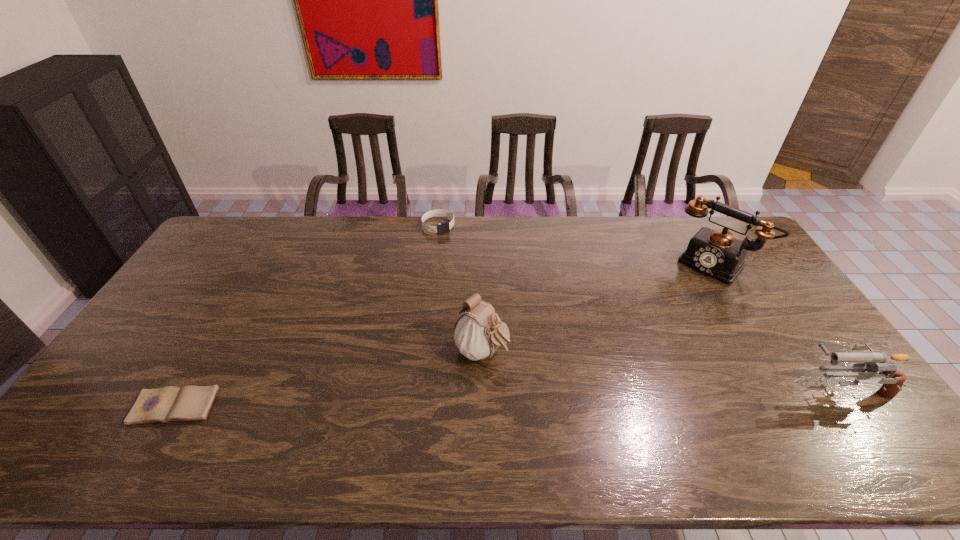
Where is `free region located at the barrel end of the third shortest object`? The image size is (960, 540). free region located at the barrel end of the third shortest object is located at coordinates (706, 388).

Identify the location of free space located at the barrel end of the third shortest object. This screenshot has height=540, width=960. (732, 388).

Where is `free space located 0.100m on the front of the tallest object at the rotary dial`? This screenshot has height=540, width=960. free space located 0.100m on the front of the tallest object at the rotary dial is located at coordinates (684, 294).

Locate an element on the screen. The width and height of the screenshot is (960, 540). vacant space located on the front of the tallest object at the rotary dial is located at coordinates click(654, 329).

The width and height of the screenshot is (960, 540). What are the coordinates of `vacant space situated 0.230m on the front of the tallest object at the rotary dial` in the screenshot? It's located at (666, 315).

At what (x,y) coordinates should I click in order to perform the action: click on vacant space positioned on the front-facing side of the third object from left to right. Please return your answer as a coordinate pair (x, y). The image size is (960, 540). Looking at the image, I should click on (536, 381).

Find the location of a particular element. vacant space situated on the front-facing side of the third object from left to right is located at coordinates (606, 420).

Find the location of a particular element. vacant space situated 0.180m on the front-facing side of the third object from left to right is located at coordinates (563, 396).

This screenshot has height=540, width=960. Find the location of `blank space located on the outer surface of the fourth object from right to left`. blank space located on the outer surface of the fourth object from right to left is located at coordinates (482, 285).

Image resolution: width=960 pixels, height=540 pixels. I want to click on vacant space located on the outer surface of the fourth object from right to left, so click(x=464, y=260).